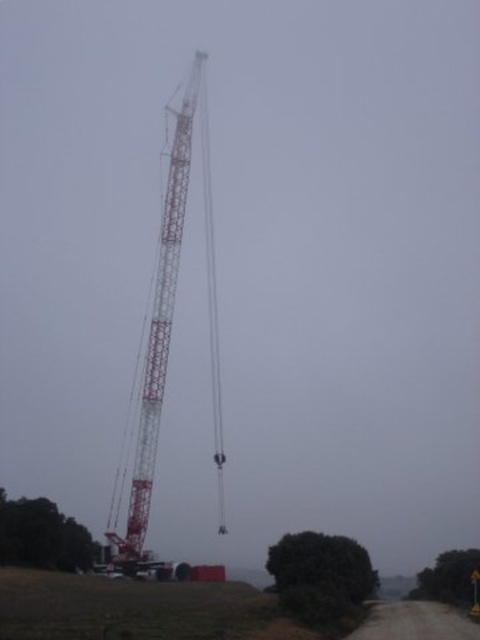
Question: Which object is farther from the camera taking this photo?

Choices:
 (A) metallic red crane at center
 (B) white metallic crane at center

Answer: (A)

Question: Which point is closer to the camera taking this photo?

Choices:
 (A) [208, 576]
 (B) [169, 248]

Answer: (A)

Question: Where is white metallic crane at center located in relation to metallic red crane at center in the image?

Choices:
 (A) right
 (B) left

Answer: (B)

Question: From the image, what is the correct spatial relationship of white metallic crane at center in relation to metallic red crane at center?

Choices:
 (A) left
 (B) right

Answer: (A)

Question: Where is white metallic crane at center located in relation to metallic red crane at center in the image?

Choices:
 (A) left
 (B) right

Answer: (A)